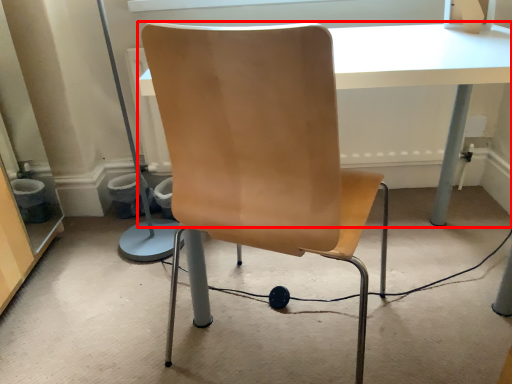
Question: Where is table (annotated by the red box) located in relation to chair in the image?

Choices:
 (A) right
 (B) left

Answer: (A)